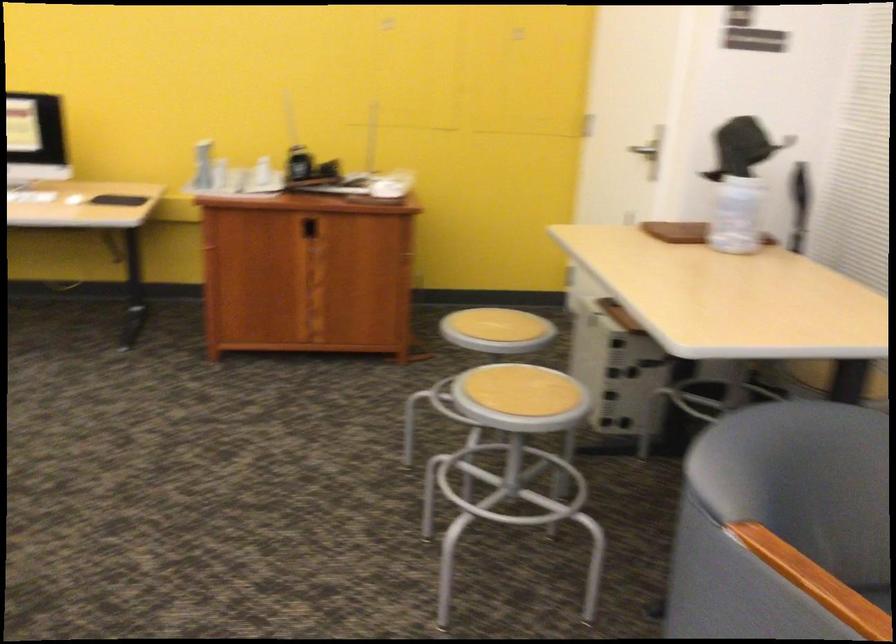
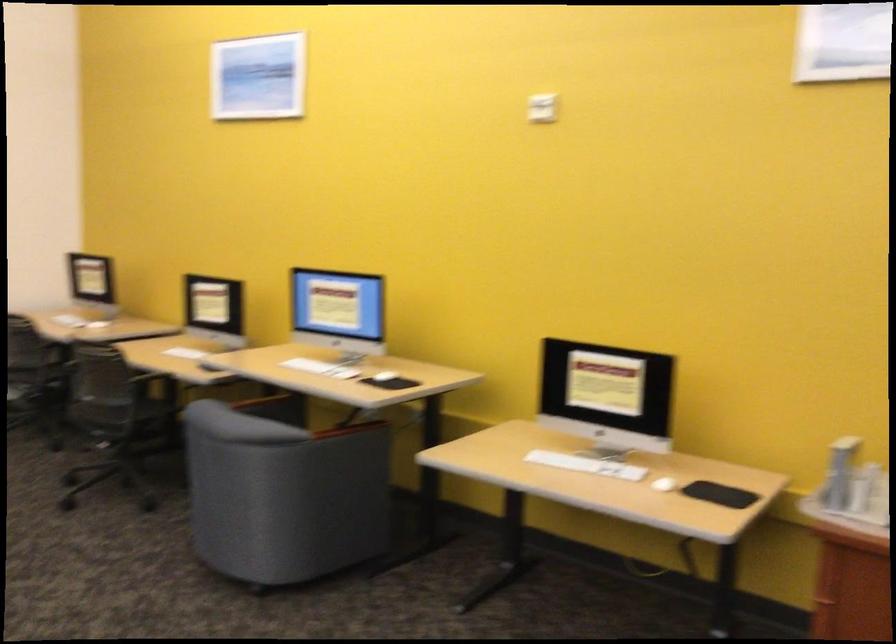
Question: The first image is from the beginning of the video and the second image is from the end. How did the camera likely rotate when shooting the video?

Choices:
 (A) Left
 (B) Right
 (C) Up
 (D) Down

Answer: (A)